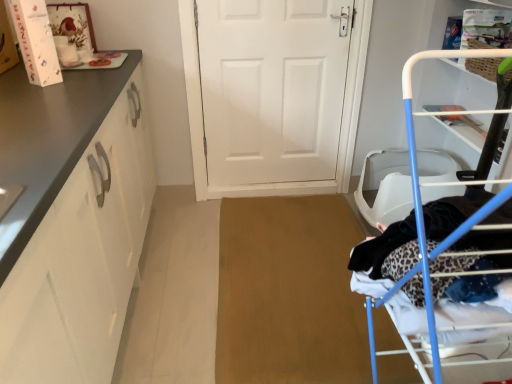
Question: Should I look upward or downward to see matte white cabinet at left?

Choices:
 (A) up
 (B) down

Answer: (B)

Question: Does blue metal drying rack at right turn towards white matte door at center?

Choices:
 (A) no
 (B) yes

Answer: (A)

Question: Is blue metal drying rack at right to the right of white matte door at center from the viewer's perspective?

Choices:
 (A) no
 (B) yes

Answer: (B)

Question: Can you confirm if blue metal drying rack at right is shorter than white matte door at center?

Choices:
 (A) yes
 (B) no

Answer: (B)

Question: Considering the relative positions of blue metal drying rack at right and white matte door at center in the image provided, is blue metal drying rack at right to the left of white matte door at center from the viewer's perspective?

Choices:
 (A) yes
 (B) no

Answer: (B)

Question: Can you confirm if blue metal drying rack at right is smaller than white matte door at center?

Choices:
 (A) yes
 (B) no

Answer: (B)

Question: Is blue metal drying rack at right positioned behind white matte door at center?

Choices:
 (A) no
 (B) yes

Answer: (A)

Question: Would you say blue metal drying rack at right is part of matte white cabinet at left's contents?

Choices:
 (A) yes
 (B) no

Answer: (B)

Question: Is matte white cabinet at left next to blue metal drying rack at right and touching it?

Choices:
 (A) yes
 (B) no

Answer: (B)

Question: From a real-world perspective, is matte white cabinet at left under blue metal drying rack at right?

Choices:
 (A) yes
 (B) no

Answer: (A)

Question: Is matte white cabinet at left aimed at blue metal drying rack at right?

Choices:
 (A) no
 (B) yes

Answer: (B)

Question: Is matte white cabinet at left at the left side of blue metal drying rack at right?

Choices:
 (A) no
 (B) yes

Answer: (B)

Question: From the image's perspective, does matte white cabinet at left appear lower than blue metal drying rack at right?

Choices:
 (A) no
 (B) yes

Answer: (A)

Question: Considering the relative sizes of blue metal drying rack at right and matte white cabinet at left in the image provided, is blue metal drying rack at right shorter than matte white cabinet at left?

Choices:
 (A) yes
 (B) no

Answer: (B)